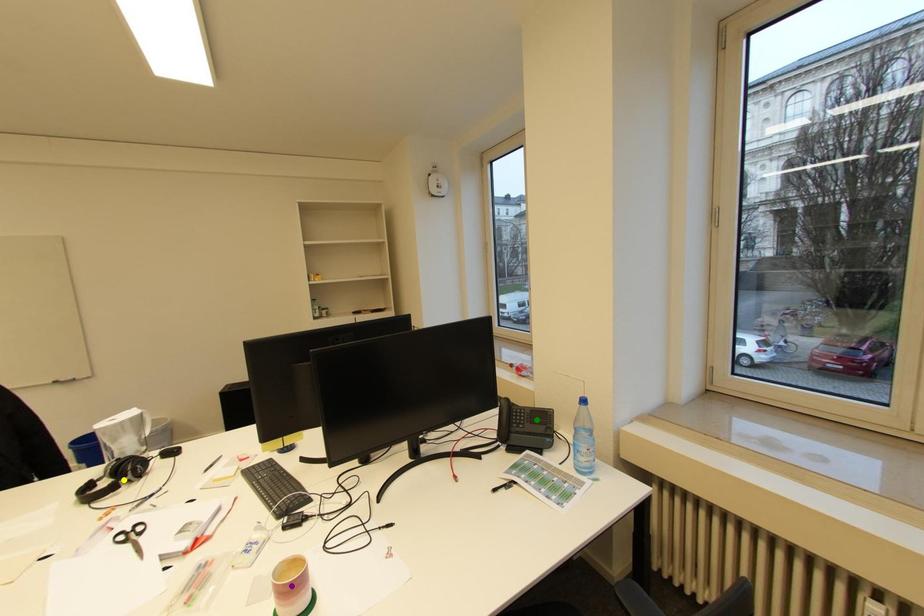
Order these from nearest to farthest:
- purple point
- yellow point
- green point

purple point < yellow point < green point